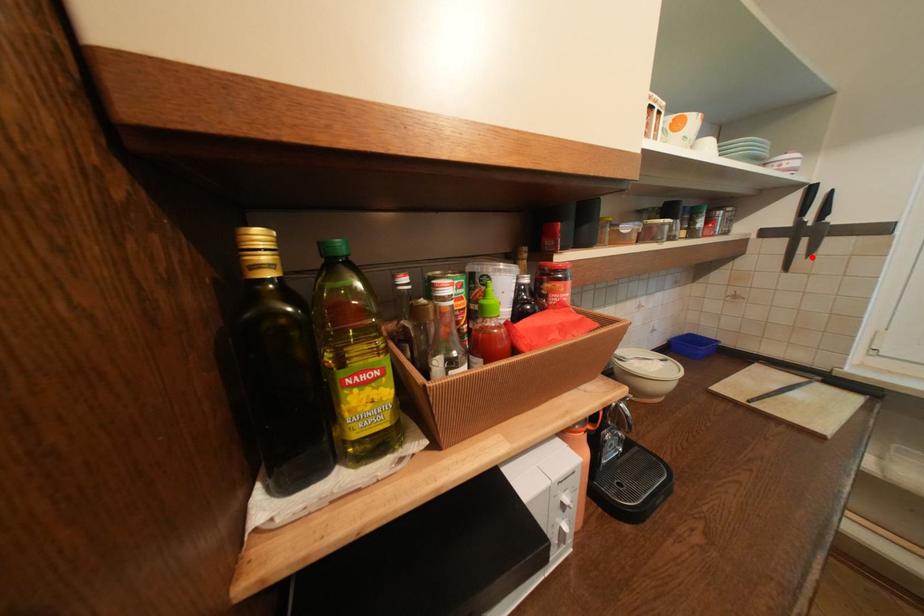
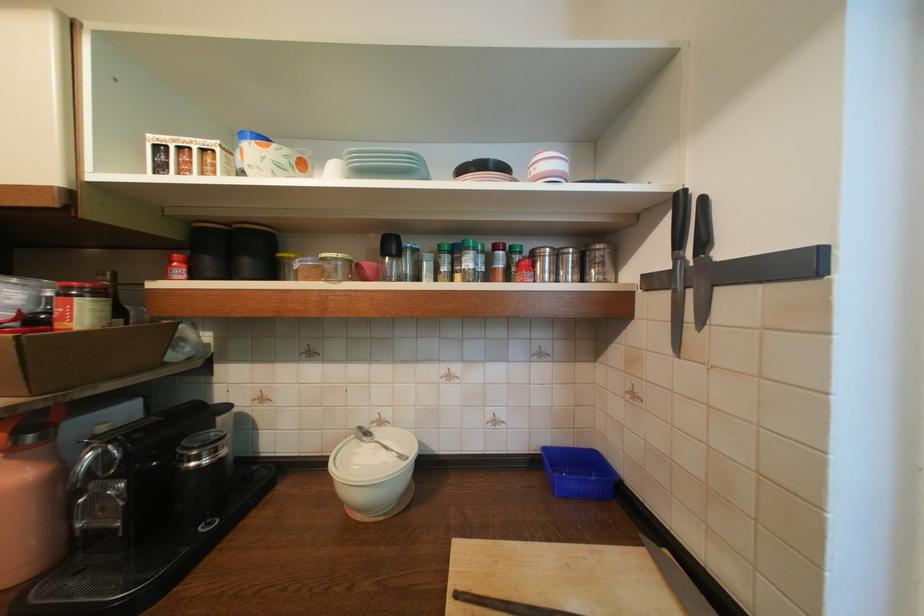
Find the pixel in the second image that matches the highlighted location in the first image.

(701, 326)